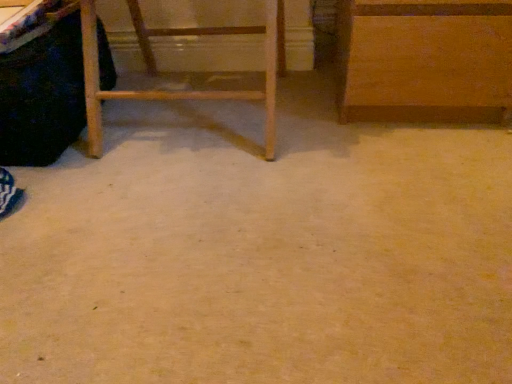
Question: Does black fabric vanity at left have a greater width compared to wooden ladder at left, the 2th furniture when ordered from right to left?

Choices:
 (A) yes
 (B) no

Answer: (A)

Question: Can we say black fabric vanity at left lies outside wooden ladder at left, the 2th furniture when ordered from right to left?

Choices:
 (A) yes
 (B) no

Answer: (A)

Question: From the image's perspective, is black fabric vanity at left located above wooden ladder at left, the first furniture positioned from the left?

Choices:
 (A) yes
 (B) no

Answer: (B)

Question: Is black fabric vanity at left turned away from wooden ladder at left, the 2th furniture when ordered from right to left?

Choices:
 (A) yes
 (B) no

Answer: (B)

Question: Is black fabric vanity at left directly adjacent to wooden ladder at left, the first furniture positioned from the left?

Choices:
 (A) yes
 (B) no

Answer: (B)

Question: From the image's perspective, is wooden ladder at left, the 2th furniture when ordered from right to left, positioned above or below wooden cabinet at upper right, the 2th furniture from the left?

Choices:
 (A) above
 (B) below

Answer: (B)

Question: Is wooden ladder at left, the 2th furniture when ordered from right to left, taller or shorter than wooden cabinet at upper right, the 2th furniture from the left?

Choices:
 (A) tall
 (B) short

Answer: (A)

Question: Does point (273, 142) appear closer or farther from the camera than point (348, 8)?

Choices:
 (A) closer
 (B) farther

Answer: (B)

Question: Would you say wooden ladder at left, the first furniture positioned from the left, is inside or outside wooden cabinet at upper right, the 2th furniture from the left?

Choices:
 (A) outside
 (B) inside

Answer: (A)

Question: Is black fabric vanity at left inside the boundaries of wooden cabinet at upper right, the 2th furniture from the left, or outside?

Choices:
 (A) outside
 (B) inside

Answer: (A)

Question: From a real-world perspective, is black fabric vanity at left above or below wooden cabinet at upper right, arranged as the first furniture when viewed from the right?

Choices:
 (A) below
 (B) above

Answer: (A)

Question: Is point (61, 29) closer or farther from the camera than point (503, 66)?

Choices:
 (A) closer
 (B) farther

Answer: (B)

Question: Would you say black fabric vanity at left is to the left or to the right of wooden cabinet at upper right, the 2th furniture from the left, in the picture?

Choices:
 (A) left
 (B) right

Answer: (A)

Question: Considering the positions of wooden cabinet at upper right, arranged as the first furniture when viewed from the right, and black fabric vanity at left in the image, is wooden cabinet at upper right, arranged as the first furniture when viewed from the right, wider or thinner than black fabric vanity at left?

Choices:
 (A) wide
 (B) thin

Answer: (B)

Question: From their relative heights in the image, would you say wooden cabinet at upper right, arranged as the first furniture when viewed from the right, is taller or shorter than black fabric vanity at left?

Choices:
 (A) short
 (B) tall

Answer: (B)